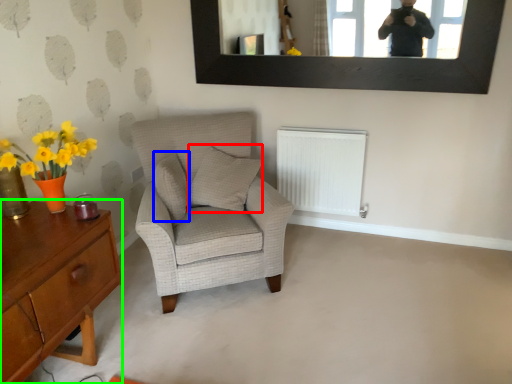
Question: Which is nearer to the pillow (highlighted by a red box)? pillow (highlighted by a blue box) or desk (highlighted by a green box).

Choices:
 (A) pillow
 (B) desk

Answer: (A)